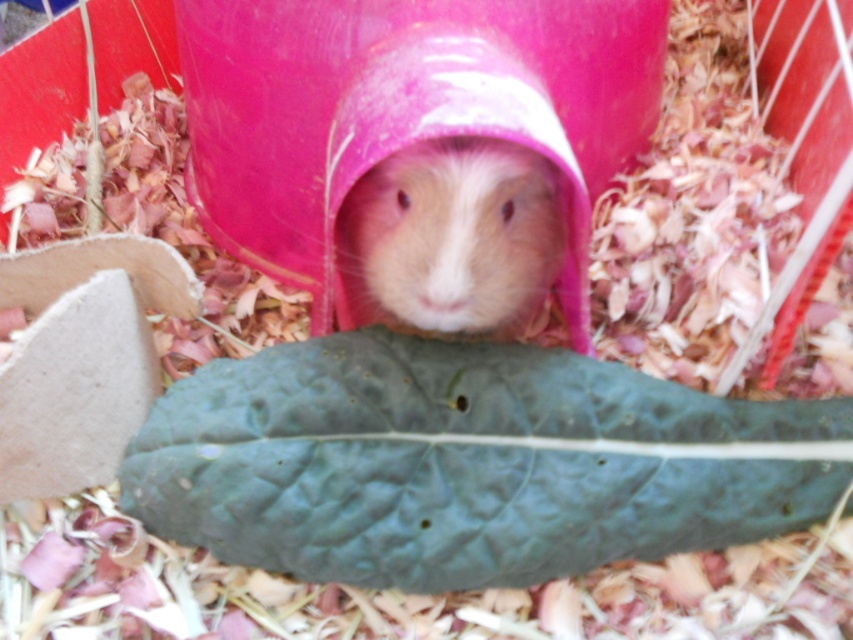
You are a researcher studying animal behavior in enclosures. You need to determine the exact location of the light brown fur hamster at center in the image. What are its coordinates?

The light brown fur hamster at center is located at coordinates point (402, 109).

You are a guinea pig in the enclosure and you want to reach the green matte leaf at center. Based on your current position inside the pink plastic tube, can you estimate how far you need to move to reach it?

The green matte leaf at center is located at point (468, 461), so the guinea pig needs to move towards that coordinate to reach it.